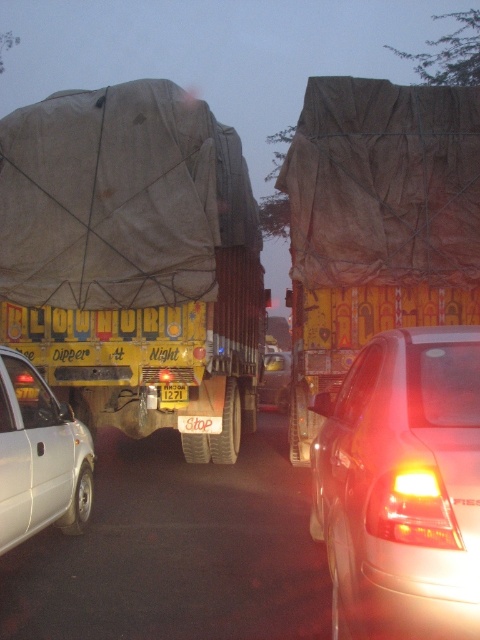
Question: Which of the following is the farthest from the observer?

Choices:
 (A) (176, 400)
 (B) (21, 532)
 (C) (355, 442)

Answer: (A)

Question: Which object appears farthest from the camera in this image?

Choices:
 (A) brown tarpaulin truck at center
 (B) yellow painted steel truck at center
 (C) white matte car at lower left
 (D) yellow matte license plate at center

Answer: (D)

Question: Can you confirm if brown tarpaulin truck at center is positioned below yellow matte license plate at center?

Choices:
 (A) yes
 (B) no

Answer: (B)

Question: Does yellow painted steel truck at center have a lesser width compared to brown tarpaulin truck at center?

Choices:
 (A) no
 (B) yes

Answer: (B)

Question: Estimate the real-world distances between objects in this image. Which object is farther from the brown tarpaulin truck at center?

Choices:
 (A) white matte car at lower left
 (B) yellow painted steel truck at center
 (C) yellow matte car at center

Answer: (C)

Question: Does yellow painted steel truck at center appear over brown tarpaulin truck at center?

Choices:
 (A) no
 (B) yes

Answer: (A)